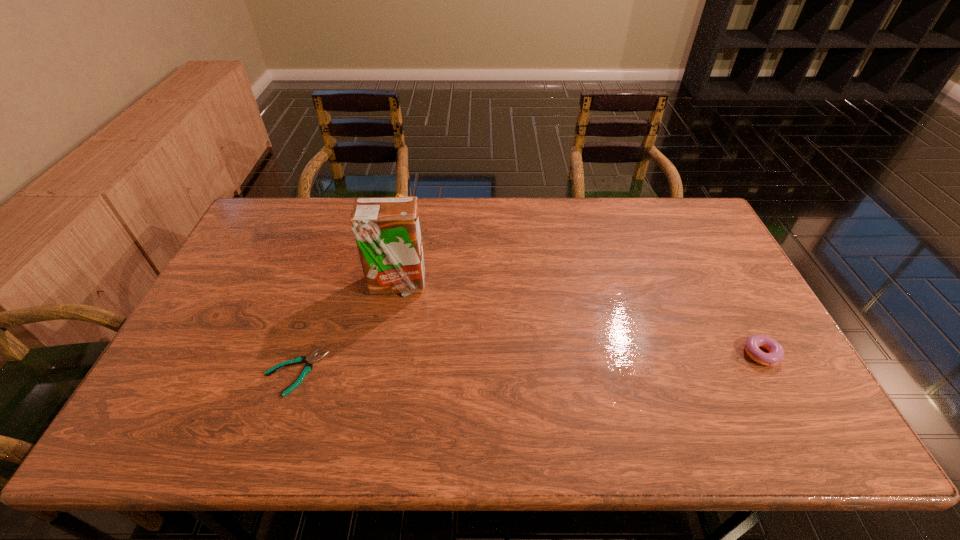
Where is `free space between the doughnut and the shortest object`? The height and width of the screenshot is (540, 960). free space between the doughnut and the shortest object is located at coordinates (529, 364).

What are the coordinates of `free space that is in between the doughnut and the second farthest object` in the screenshot? It's located at (x=580, y=320).

This screenshot has width=960, height=540. Find the location of `blank region between the farthest object and the shortest object`. blank region between the farthest object and the shortest object is located at coordinates (349, 296).

Where is `unoccupied position between the rightmost object and the tallest object`? unoccupied position between the rightmost object and the tallest object is located at coordinates (580, 320).

Identify the location of free area in between the third shortest object and the doughnut. (583, 289).

Locate which object is the second closest to the tallest object. Please provide its 2D coordinates. Your answer should be formatted as a tuple, i.e. [(x, y)], where the tuple contains the x and y coordinates of a point satisfying the conditions above.

[(398, 195)]

This screenshot has width=960, height=540. I want to click on the closest object relative to the tallest object, so click(308, 367).

Locate an element on the screen. vacant space that satisfies the following two spatial constraints: 1. on the front side of the Lego; 2. on the right side of the rightmost object is located at coordinates (376, 356).

Identify the location of vacant position in the image that satisfies the following two spatial constraints: 1. on the back side of the second shortest object; 2. on the right side of the pliers. The height and width of the screenshot is (540, 960). (300, 356).

This screenshot has height=540, width=960. What are the coordinates of `vacant space that satisfies the following two spatial constraints: 1. on the back side of the shortest object; 2. on the right side of the doughnut` in the screenshot? It's located at (300, 356).